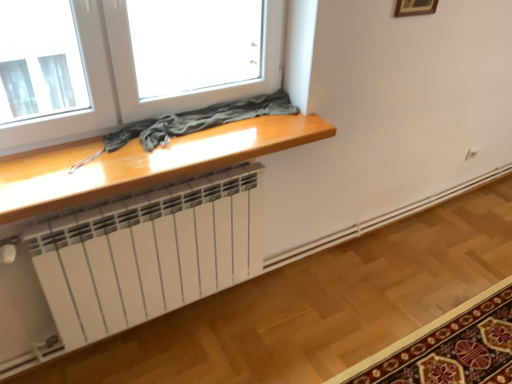
Question: Considering the relative sizes of glossy wood table at upper center and wooden picture frame at upper right in the image provided, is glossy wood table at upper center smaller than wooden picture frame at upper right?

Choices:
 (A) yes
 (B) no

Answer: (B)

Question: Is the position of glossy wood table at upper center more distant than that of wooden picture frame at upper right?

Choices:
 (A) no
 (B) yes

Answer: (A)

Question: Is wooden picture frame at upper right at the back of glossy wood table at upper center?

Choices:
 (A) no
 (B) yes

Answer: (A)

Question: From a real-world perspective, is glossy wood table at upper center on top of wooden picture frame at upper right?

Choices:
 (A) yes
 (B) no

Answer: (B)

Question: Does glossy wood table at upper center contain wooden picture frame at upper right?

Choices:
 (A) no
 (B) yes

Answer: (A)

Question: Considering the positions of glossy wood table at upper center and wooden picture frame at upper right in the image, is glossy wood table at upper center wider or thinner than wooden picture frame at upper right?

Choices:
 (A) wide
 (B) thin

Answer: (A)

Question: In the image, is glossy wood table at upper center on the left side or the right side of wooden picture frame at upper right?

Choices:
 (A) right
 (B) left

Answer: (B)

Question: Is glossy wood table at upper center in front of or behind wooden picture frame at upper right in the image?

Choices:
 (A) behind
 (B) front

Answer: (B)

Question: Is point (138, 148) positioned closer to the camera than point (412, 6)?

Choices:
 (A) farther
 (B) closer

Answer: (B)

Question: Relative to glossy wood table at upper center, is wooden picture frame at upper right in front or behind?

Choices:
 (A) behind
 (B) front

Answer: (A)

Question: From a real-world perspective, is wooden picture frame at upper right positioned above or below glossy wood table at upper center?

Choices:
 (A) above
 (B) below

Answer: (A)

Question: Considering the positions of point (409, 13) and point (304, 129), is point (409, 13) closer or farther from the camera than point (304, 129)?

Choices:
 (A) farther
 (B) closer

Answer: (A)

Question: Looking at their shapes, would you say wooden picture frame at upper right is wider or thinner than glossy wood table at upper center?

Choices:
 (A) wide
 (B) thin

Answer: (B)

Question: Looking at their shapes, would you say carpet with floral pattern at lower right is wider or thinner than glossy wood table at upper center?

Choices:
 (A) thin
 (B) wide

Answer: (B)

Question: Would you say carpet with floral pattern at lower right is to the left or to the right of glossy wood table at upper center in the picture?

Choices:
 (A) left
 (B) right

Answer: (B)